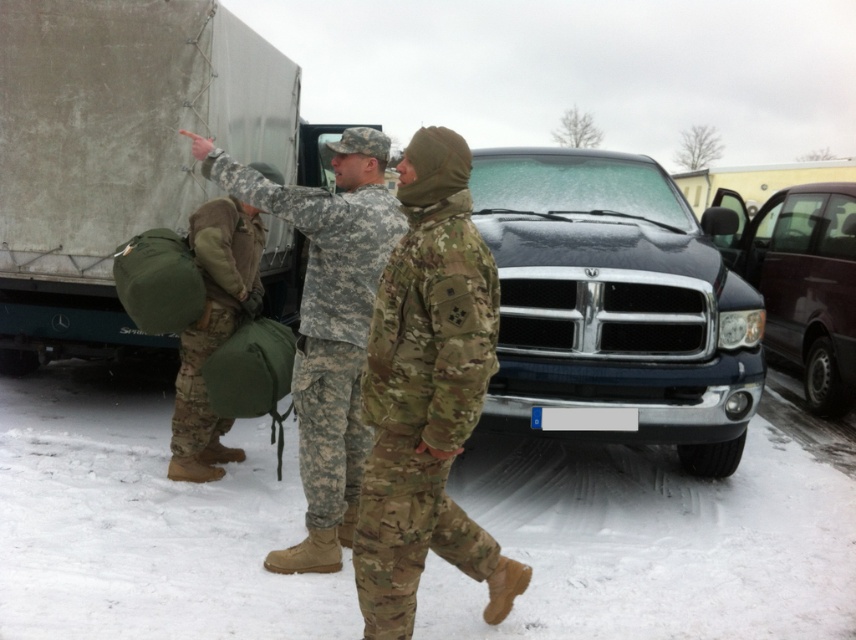
Question: In this image, where is white powdery snow at lower center located relative to camouflage fabric backpack at left?

Choices:
 (A) left
 (B) right

Answer: (B)

Question: Is gray matte truck at upper left wider than camouflage uniform at center?

Choices:
 (A) no
 (B) yes

Answer: (B)

Question: Among these objects, which one is nearest to the camera?

Choices:
 (A) white powdery snow at lower center
 (B) gray matte truck at upper left

Answer: (A)

Question: Does white powdery snow at lower center have a lesser width compared to black matte truck at center?

Choices:
 (A) yes
 (B) no

Answer: (B)

Question: Which object is farther from the camera taking this photo?

Choices:
 (A) camouflage uniform at center
 (B) gray matte truck at upper left
 (C) black matte truck at center
 (D) camouflage fabric backpack at left

Answer: (C)

Question: Which of the following is the farthest from the observer?

Choices:
 (A) white powdery snow at lower center
 (B) camouflage fabric backpack at left

Answer: (B)